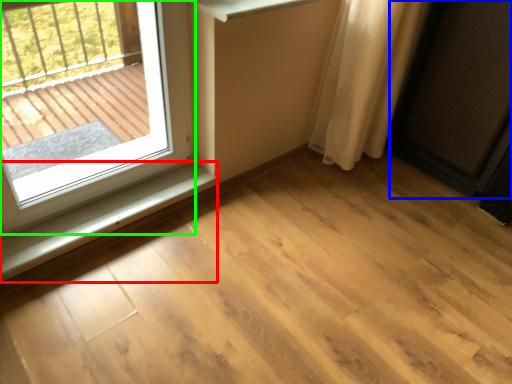
Question: Which is nearer to the window sill (highlighted by a red box)? screen door (highlighted by a blue box) or window (highlighted by a green box).

Choices:
 (A) screen door
 (B) window

Answer: (B)